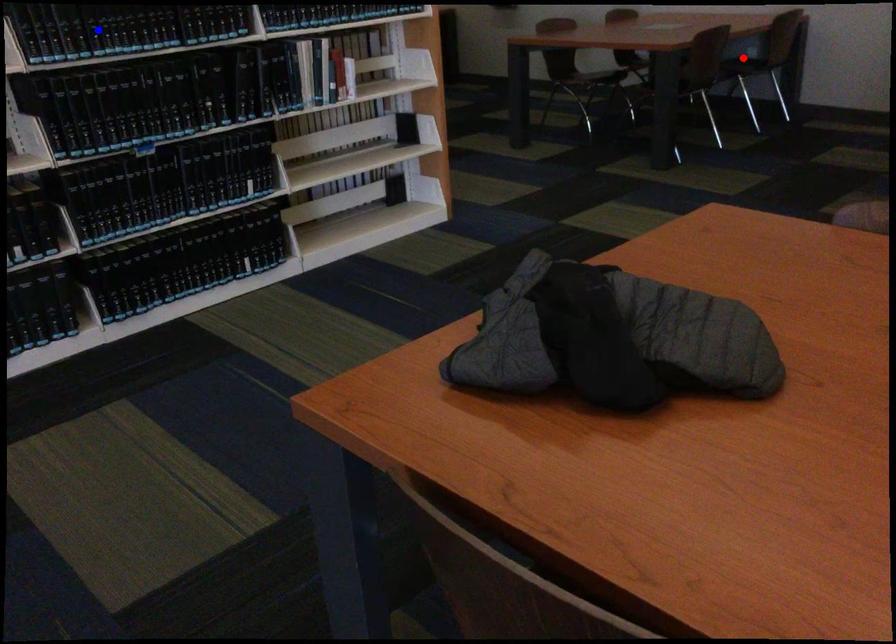
Question: Which of the two points in the image is closer to the camera?

Choices:
 (A) Blue point is closer.
 (B) Red point is closer.

Answer: (A)